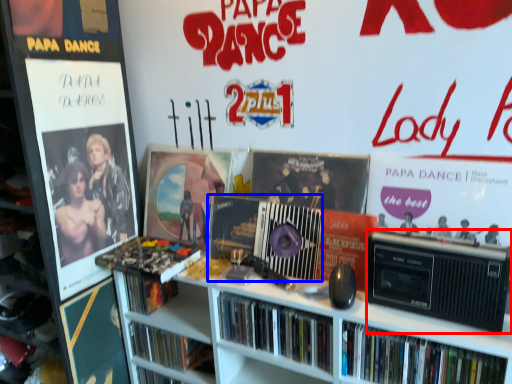
Question: Among these objects, which one is farthest to the camera, cassette (highlighted by a red box) or cassette (highlighted by a blue box)?

Choices:
 (A) cassette
 (B) cassette

Answer: (B)